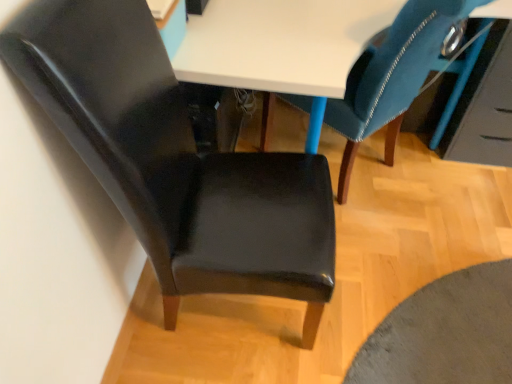
Question: Considering the relative sizes of glossy blue drawer at upper right and matte black chair at left, marked as the 2th chair in a right-to-left arrangement, in the image provided, is glossy blue drawer at upper right smaller than matte black chair at left, marked as the 2th chair in a right-to-left arrangement,?

Choices:
 (A) no
 (B) yes

Answer: (B)

Question: Considering the relative sizes of glossy blue drawer at upper right and matte black chair at left, acting as the first chair starting from the left, in the image provided, is glossy blue drawer at upper right taller than matte black chair at left, acting as the first chair starting from the left,?

Choices:
 (A) yes
 (B) no

Answer: (B)

Question: From a real-world perspective, is glossy blue drawer at upper right on matte black chair at left, marked as the 2th chair in a right-to-left arrangement?

Choices:
 (A) yes
 (B) no

Answer: (B)

Question: Is glossy blue drawer at upper right wider than matte black chair at left, acting as the first chair starting from the left?

Choices:
 (A) no
 (B) yes

Answer: (A)

Question: Is glossy blue drawer at upper right thinner than matte black chair at left, marked as the 2th chair in a right-to-left arrangement?

Choices:
 (A) no
 (B) yes

Answer: (B)

Question: Would you say matte black chair at left, marked as the 2th chair in a right-to-left arrangement, is inside or outside glossy blue drawer at upper right?

Choices:
 (A) inside
 (B) outside

Answer: (B)

Question: In terms of width, does matte black chair at left, acting as the first chair starting from the left, look wider or thinner when compared to glossy blue drawer at upper right?

Choices:
 (A) wide
 (B) thin

Answer: (A)

Question: From the image's perspective, is matte black chair at left, acting as the first chair starting from the left, positioned above or below glossy blue drawer at upper right?

Choices:
 (A) above
 (B) below

Answer: (B)

Question: Is point (148, 114) positioned closer to the camera than point (454, 142)?

Choices:
 (A) farther
 (B) closer

Answer: (B)

Question: From a real-world perspective, is glossy blue drawer at upper right above or below velvet blue chair at upper right, the 1th chair when ordered from right to left?

Choices:
 (A) above
 (B) below

Answer: (B)

Question: Do you think glossy blue drawer at upper right is within velvet blue chair at upper right, the 1th chair when ordered from right to left, or outside of it?

Choices:
 (A) outside
 (B) inside

Answer: (A)

Question: Considering the positions of glossy blue drawer at upper right and velvet blue chair at upper right, which is counted as the second chair, starting from the left, in the image, is glossy blue drawer at upper right wider or thinner than velvet blue chair at upper right, which is counted as the second chair, starting from the left,?

Choices:
 (A) wide
 (B) thin

Answer: (B)

Question: Is glossy blue drawer at upper right taller or shorter than velvet blue chair at upper right, the 1th chair when ordered from right to left?

Choices:
 (A) tall
 (B) short

Answer: (B)

Question: In terms of size, does velvet blue chair at upper right, the 1th chair when ordered from right to left, appear bigger or smaller than glossy blue drawer at upper right?

Choices:
 (A) small
 (B) big

Answer: (B)

Question: Is point (369, 114) positioned closer to the camera than point (499, 81)?

Choices:
 (A) closer
 (B) farther

Answer: (A)